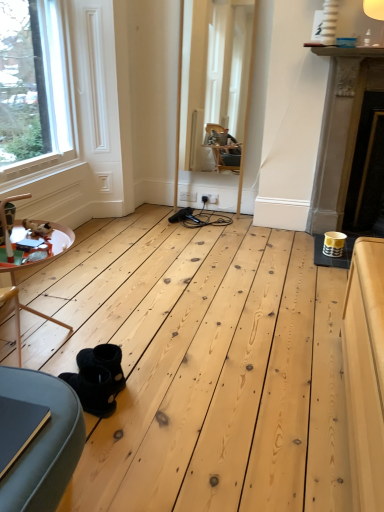
The width and height of the screenshot is (384, 512). Find the location of `gold metallic fireplace at right`. gold metallic fireplace at right is located at coordinates (350, 148).

In order to face clear glass window at upper left, should I rotate leftwards or rightwards?

Rotate left and turn 21.466 degrees.

Image resolution: width=384 pixels, height=512 pixels. What are the coordinates of `wooden table at lower left` in the screenshot? It's located at (59, 241).

Is clear glass window at upper left further to the viewer compared to black suede boots at lower left?

Yes, clear glass window at upper left is further from the viewer.

In terms of size, does clear glass window at upper left appear bigger or smaller than black suede boots at lower left?

Considering their sizes, clear glass window at upper left takes up more space than black suede boots at lower left.

Are clear glass window at upper left and black suede boots at lower left making contact?

There is a gap between clear glass window at upper left and black suede boots at lower left.

Considering the positions of point (24, 36) and point (100, 410), is point (24, 36) closer or farther from the camera than point (100, 410)?

Point (24, 36) is positioned farther from the camera compared to point (100, 410).

Find the location of a particular element. The height and width of the screenshot is (512, 384). footwear below the wooden table at lower left (from the image's perspective) is located at coordinates (93, 389).

Between point (64, 374) and point (20, 237), which one is positioned in front?

The point (64, 374) is in front.

Which is more to the left, black suede boots at lower left or wooden table at lower left?

wooden table at lower left is more to the left.

How different are the orientations of black suede boots at lower left and wooden table at lower left in degrees?

black suede boots at lower left and wooden table at lower left are facing 178 degrees away from each other.

From a real-world perspective, which object stands above the other?

gold metallic fireplace at right.

Is wooden table at lower left oriented towards gold metallic fireplace at right?

No, wooden table at lower left is not oriented towards gold metallic fireplace at right.

Considering the sizes of objects wooden table at lower left and gold metallic fireplace at right in the image provided, who is bigger, wooden table at lower left or gold metallic fireplace at right?

gold metallic fireplace at right is bigger.

Measure the distance from wooden table at lower left to gold metallic fireplace at right.

wooden table at lower left is 2.03 meters from gold metallic fireplace at right.

Which object is closer to the camera taking this photo, gold metallic fireplace at right or clear glass window at upper left?

clear glass window at upper left.

Is gold metallic fireplace at right spatially inside clear glass window at upper left, or outside of it?

gold metallic fireplace at right exists outside the volume of clear glass window at upper left.

Does point (366, 142) appear closer or farther from the camera than point (48, 35)?

Point (366, 142).

From the image's perspective, is gold metallic fireplace at right positioned above or below clear glass window at upper left?

From the image's perspective, gold metallic fireplace at right appears below clear glass window at upper left.

Does clear glass window at upper left appear on the left side of wooden table at lower left?

Correct, you'll find clear glass window at upper left to the left of wooden table at lower left.

Between clear glass window at upper left and wooden table at lower left, which one has larger width?

wooden table at lower left.

This screenshot has width=384, height=512. I want to click on table below the clear glass window at upper left (from the image's perspective), so click(59, 241).

Does point (3, 50) appear closer or farther from the camera than point (49, 250)?

Point (3, 50).

Could you tell me if black suede boots at lower left is turned towards gold metallic fireplace at right?

No.

From a real-world perspective, is black suede boots at lower left beneath gold metallic fireplace at right?

Yes.

From the image's perspective, is black suede boots at lower left located above or below gold metallic fireplace at right?

black suede boots at lower left is below gold metallic fireplace at right.

Can gold metallic fireplace at right be found inside black suede boots at lower left?

No, gold metallic fireplace at right is located outside of black suede boots at lower left.

Which object is further away from the camera, wooden table at lower left or black suede boots at lower left?

black suede boots at lower left is further away from the camera.

What are the coordinates of `table located in front of the black suede boots at lower left` in the screenshot? It's located at (59, 241).

Between point (18, 226) and point (69, 376), which one is positioned in front?

The point (69, 376) is in front.

How different are the orientations of wooden table at lower left and black suede boots at lower left in degrees?

The angle between the facing direction of wooden table at lower left and the facing direction of black suede boots at lower left is 178 degrees.

The width and height of the screenshot is (384, 512). I want to click on footwear below the clear glass window at upper left (from a real-world perspective), so click(x=93, y=389).

This screenshot has height=512, width=384. I want to click on table above the black suede boots at lower left (from the image's perspective), so click(59, 241).

When comparing their distances from clear glass window at upper left, does black suede boots at lower left or gold metallic fireplace at right seem closer?

gold metallic fireplace at right is positioned closer to the anchor clear glass window at upper left.

Consider the image. Looking at the image, which one is located further to gold metallic fireplace at right, wooden table at lower left or clear glass window at upper left?

wooden table at lower left lies further to gold metallic fireplace at right than the other object.

Considering their positions, is wooden table at lower left positioned further to black suede boots at lower left than gold metallic fireplace at right?

gold metallic fireplace at right.

Based on their spatial positions, is clear glass window at upper left or black suede boots at lower left further from wooden table at lower left?

clear glass window at upper left is positioned further to the anchor wooden table at lower left.

In the scene shown: Estimate the real-world distances between objects in this image. Which object is further from black suede boots at lower left, gold metallic fireplace at right or wooden table at lower left?

gold metallic fireplace at right is positioned further to the anchor black suede boots at lower left.

From the image, which object appears to be farther from clear glass window at upper left, gold metallic fireplace at right or black suede boots at lower left?

black suede boots at lower left lies further to clear glass window at upper left than the other object.

Looking at the image, which one is located further to wooden table at lower left, gold metallic fireplace at right or clear glass window at upper left?

The object further to wooden table at lower left is gold metallic fireplace at right.

From the image, which object appears to be farther from clear glass window at upper left, black suede boots at lower left or wooden table at lower left?

The object further to clear glass window at upper left is black suede boots at lower left.

Identify the location of footwear between clear glass window at upper left and gold metallic fireplace at right. (93, 389).

I want to click on table between clear glass window at upper left and black suede boots at lower left in the up-down direction, so click(x=59, y=241).

You are a GUI agent. You are given a task and a screenshot of the screen. Output one action in this format:
    pyautogui.click(x=<x>, y=<y>)
    Task: Click on the footwear located between wooden table at lower left and gold metallic fireplace at right in the left-right direction
    This screenshot has width=384, height=512.
    Given the screenshot: What is the action you would take?
    pyautogui.click(x=93, y=389)

Where is `table between clear glass window at upper left and gold metallic fireplace at right in the horizontal direction`? The image size is (384, 512). table between clear glass window at upper left and gold metallic fireplace at right in the horizontal direction is located at coordinates (59, 241).